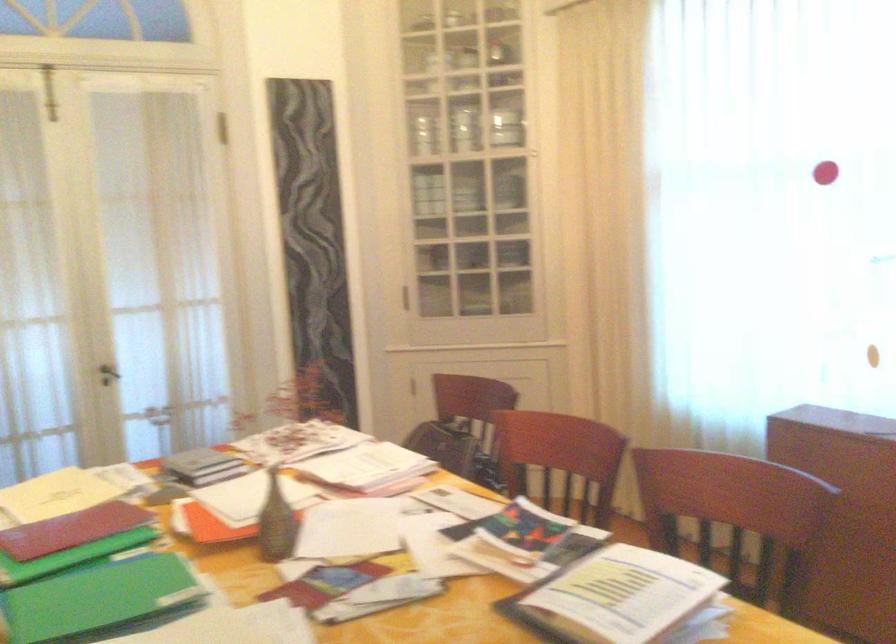
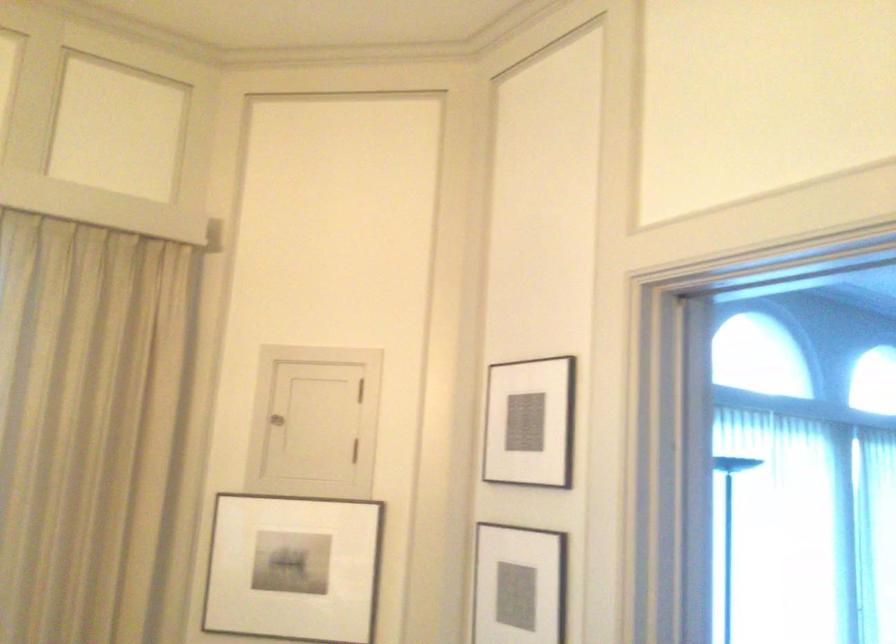
The first image is from the beginning of the video and the second image is from the end. How did the camera likely rotate when shooting the video?

The rotation direction of the camera is right-up.